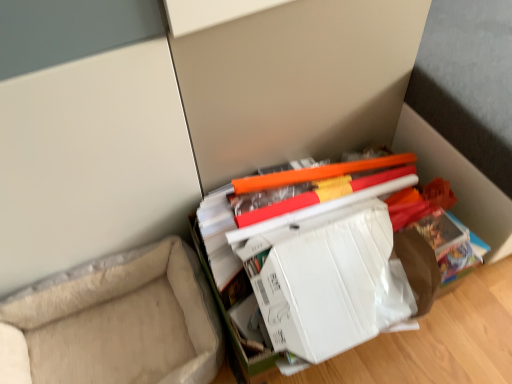
Where is `beige fabric couch at lower left`? This screenshot has width=512, height=384. beige fabric couch at lower left is located at coordinates (115, 323).

What do you see at coordinates (115, 323) in the screenshot?
I see `beige fabric couch at lower left` at bounding box center [115, 323].

I want to click on white cardboard box at center, so click(330, 285).

The image size is (512, 384). What do you see at coordinates (330, 285) in the screenshot?
I see `white cardboard box at center` at bounding box center [330, 285].

Find the location of `beige fabric couch at lower left`. beige fabric couch at lower left is located at coordinates (115, 323).

Is beige fabric couch at lower left to the left of white cardboard box at center from the viewer's perspective?

Indeed, beige fabric couch at lower left is positioned on the left side of white cardboard box at center.

Considering the relative positions of beige fabric couch at lower left and white cardboard box at center in the image provided, is beige fabric couch at lower left in front of white cardboard box at center?

No, beige fabric couch at lower left is behind white cardboard box at center.

Considering the positions of point (146, 375) and point (345, 254), is point (146, 375) closer or farther from the camera than point (345, 254)?

Point (146, 375) is positioned farther from the camera compared to point (345, 254).

From the image's perspective, which is below, beige fabric couch at lower left or white cardboard box at center?

beige fabric couch at lower left.

From a real-world perspective, is beige fabric couch at lower left located beneath white cardboard box at center?

Indeed, from a real-world perspective, beige fabric couch at lower left is positioned beneath white cardboard box at center.

Does beige fabric couch at lower left have a lesser width compared to white cardboard box at center?

In fact, beige fabric couch at lower left might be wider than white cardboard box at center.

Who is taller, beige fabric couch at lower left or white cardboard box at center?

white cardboard box at center is taller.

Which of these two, beige fabric couch at lower left or white cardboard box at center, is bigger?

beige fabric couch at lower left.

Is beige fabric couch at lower left spatially inside white cardboard box at center, or outside of it?

beige fabric couch at lower left lies outside white cardboard box at center.

Is beige fabric couch at lower left far away from white cardboard box at center?

Actually, beige fabric couch at lower left and white cardboard box at center are a little close together.

Could you tell me if beige fabric couch at lower left is turned towards white cardboard box at center?

No, beige fabric couch at lower left is not facing towards white cardboard box at center.

Consider the image. Can you tell me how much beige fabric couch at lower left and white cardboard box at center differ in facing direction?

beige fabric couch at lower left and white cardboard box at center are facing 3.78 degrees away from each other.

Measure the distance from beige fabric couch at lower left to white cardboard box at center.

They are 13.09 inches apart.

Find the location of a particular element. The height and width of the screenshot is (384, 512). furniture lying below the white cardboard box at center (from the image's perspective) is located at coordinates (115, 323).

Which object is positioned more to the right, white cardboard box at center or beige fabric couch at lower left?

white cardboard box at center.

Who is more distant, white cardboard box at center or beige fabric couch at lower left?

beige fabric couch at lower left.

Does point (349, 222) appear closer or farther from the camera than point (116, 296)?

Point (349, 222) is closer to the camera than point (116, 296).

From the image's perspective, would you say white cardboard box at center is shown under beige fabric couch at lower left?

Incorrect, from the image's perspective, white cardboard box at center is higher than beige fabric couch at lower left.

From a real-world perspective, between white cardboard box at center and beige fabric couch at lower left, who is vertically higher?

white cardboard box at center is physically above.

Considering the relative sizes of white cardboard box at center and beige fabric couch at lower left in the image provided, is white cardboard box at center thinner than beige fabric couch at lower left?

Correct, the width of white cardboard box at center is less than that of beige fabric couch at lower left.

Does white cardboard box at center have a greater height compared to beige fabric couch at lower left?

Correct, white cardboard box at center is much taller as beige fabric couch at lower left.

Between white cardboard box at center and beige fabric couch at lower left, which one has larger size?

beige fabric couch at lower left.

Is beige fabric couch at lower left located within white cardboard box at center?

No, beige fabric couch at lower left is not inside white cardboard box at center.

Would you say white cardboard box at center is a long distance from beige fabric couch at lower left?

Actually, white cardboard box at center and beige fabric couch at lower left are a little close together.

Is white cardboard box at center facing away from beige fabric couch at lower left?

No, beige fabric couch at lower left is not at the back of white cardboard box at center.

Locate an element on the screen. The width and height of the screenshot is (512, 384). furniture that is behind the white cardboard box at center is located at coordinates (115, 323).

At what (x,y) coordinates should I click in order to perform the action: click on paperback book located on the right of beige fabric couch at lower left. Please return your answer as a coordinate pair (x, y). The image size is (512, 384). Looking at the image, I should click on point(330,285).

Find the location of a particular element. Image resolution: width=512 pixels, height=384 pixels. furniture behind the white cardboard box at center is located at coordinates (115, 323).